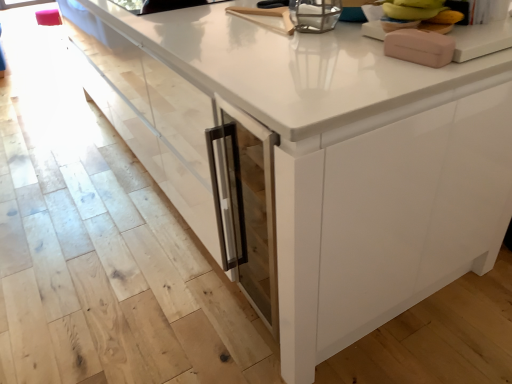
Question: Considering their positions, is pink matte soap dispenser at upper right, which is the first appliance in front-to-back order, located in front of or behind metallic glass container at upper center, positioned as the 1th appliance in back-to-front order?

Choices:
 (A) behind
 (B) front

Answer: (B)

Question: Considering the positions of pink matte soap dispenser at upper right, acting as the second appliance starting from the left, and metallic glass container at upper center, the second appliance from the front, in the image, is pink matte soap dispenser at upper right, acting as the second appliance starting from the left, bigger or smaller than metallic glass container at upper center, the second appliance from the front,?

Choices:
 (A) small
 (B) big

Answer: (A)

Question: Estimate the real-world distances between objects in this image. Which object is farther from the pink matte soap dispenser at upper right, which is the first appliance in front-to-back order?

Choices:
 (A) metallic glass container at upper center, arranged as the second appliance when ordered from the bottom
 (B) yellow banana at upper right

Answer: (A)

Question: Which object is the closest to the pink matte soap dispenser at upper right, the 2th appliance when ordered from back to front?

Choices:
 (A) metallic glass container at upper center, acting as the first appliance starting from the left
 (B) yellow banana at upper right

Answer: (B)